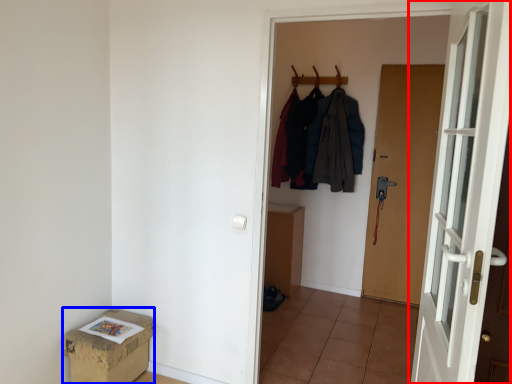
Question: Which of the following is the closest to the observer, door (highlighted by a red box) or box (highlighted by a blue box)?

Choices:
 (A) door
 (B) box

Answer: (A)